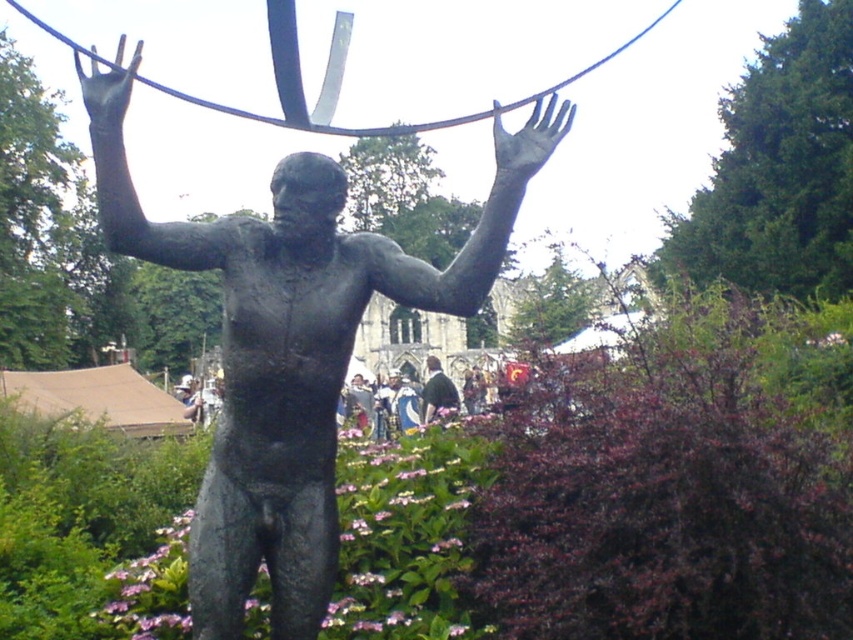
Question: Does bronze metallic hand at upper center appear over bronze hand at upper center?

Choices:
 (A) no
 (B) yes

Answer: (A)

Question: Which of the following is the farthest from the observer?

Choices:
 (A) (497, 128)
 (B) (80, 80)
 (C) (448, 401)

Answer: (C)

Question: Which of the following is the farthest from the observer?

Choices:
 (A) bronze metallic hand at upper center
 (B) bronze hand at upper center

Answer: (A)

Question: Can you confirm if bronze metallic hand at upper center is thinner than bronze hand at upper center?

Choices:
 (A) yes
 (B) no

Answer: (A)

Question: Where is bronze metallic hand at upper center located in relation to bronze hand at upper center in the image?

Choices:
 (A) right
 (B) left

Answer: (A)

Question: Which point appears closest to the camera in this image?

Choices:
 (A) (431, 372)
 (B) (285, 205)
 (C) (115, 93)
 (D) (537, 124)

Answer: (C)